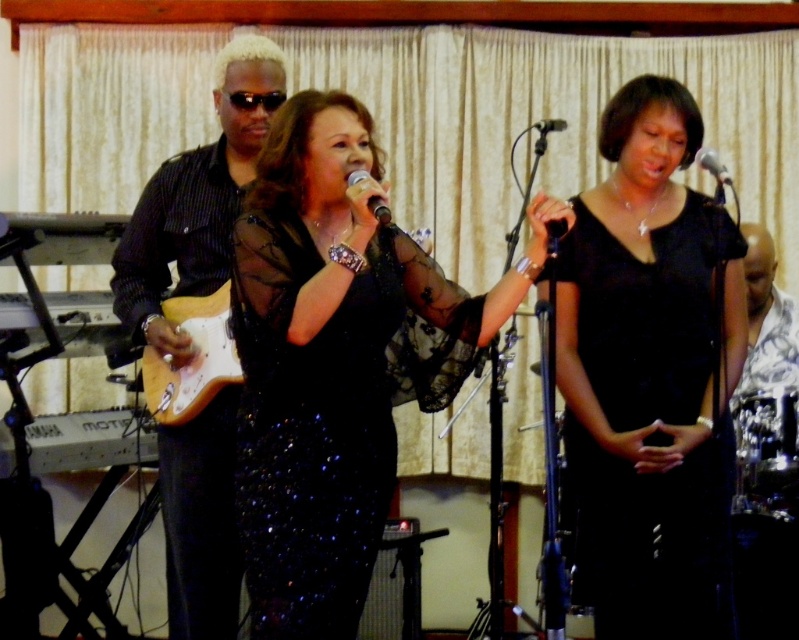
You are a photographer in the audience and want to capture a clear shot of the black satin dress at center and the black matte microphone at upper center. Which object will appear larger in your photo?

The black satin dress at center will appear larger in the photo because it is closer to the viewer than the black matte microphone at upper center.

You are a stagehand needing to place a 1.2 meter wide backdrop behind the shiny black shirt at left and the light wood electric guitar at center. Which object requires the backdrop to be wider to accommodate its width?

The shiny black shirt at left requires the backdrop to be wider because it is wider than the light wood electric guitar at center according to the description.

You are a stage designer who needs to place a spotlight exactly at the center of the stage. The coordinates of the stage are from 0 to 1 on both axes. Given the position of the black satin dress at center, will the spotlight hit the dress?

The black satin dress at center is located at point (650, 376), which is close to the center of the stage, so the spotlight placed at the center will likely hit the dress.